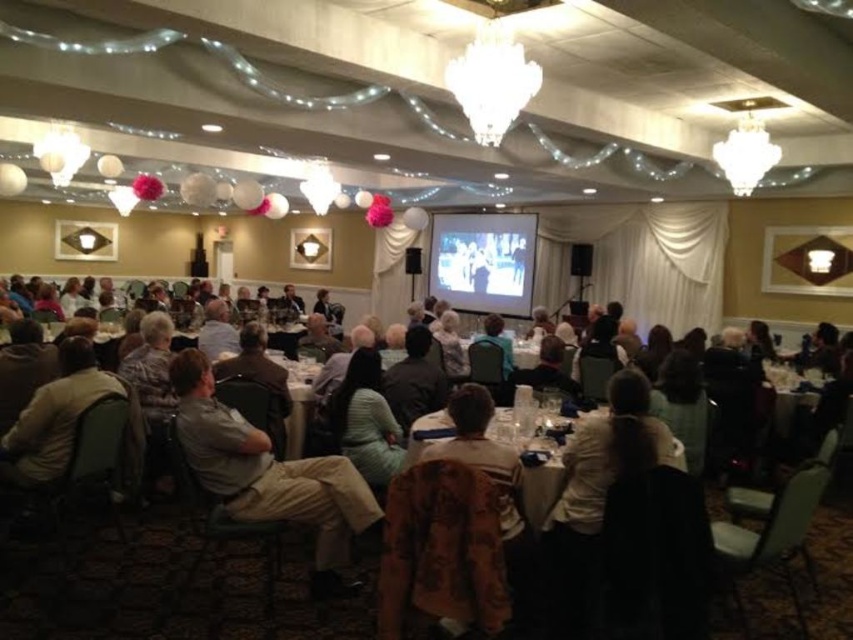
You are standing in the banquet hall and want to take a photo. You notice two points in the image labeled as point (311, 576) and point (289, 426). Which point would appear larger in your camera view?

Point (311, 576) is closer to the camera than point (289, 426), so it would appear larger in the camera view.